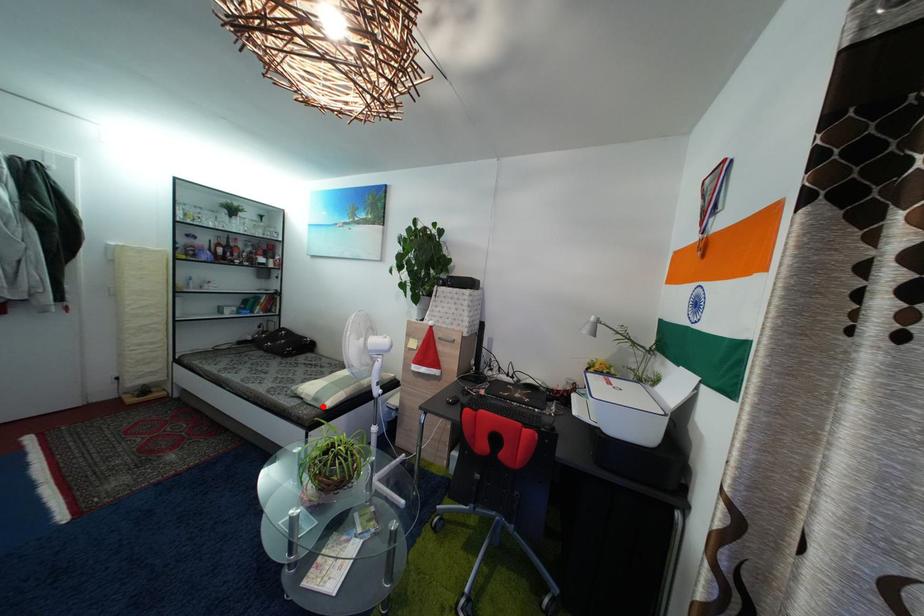
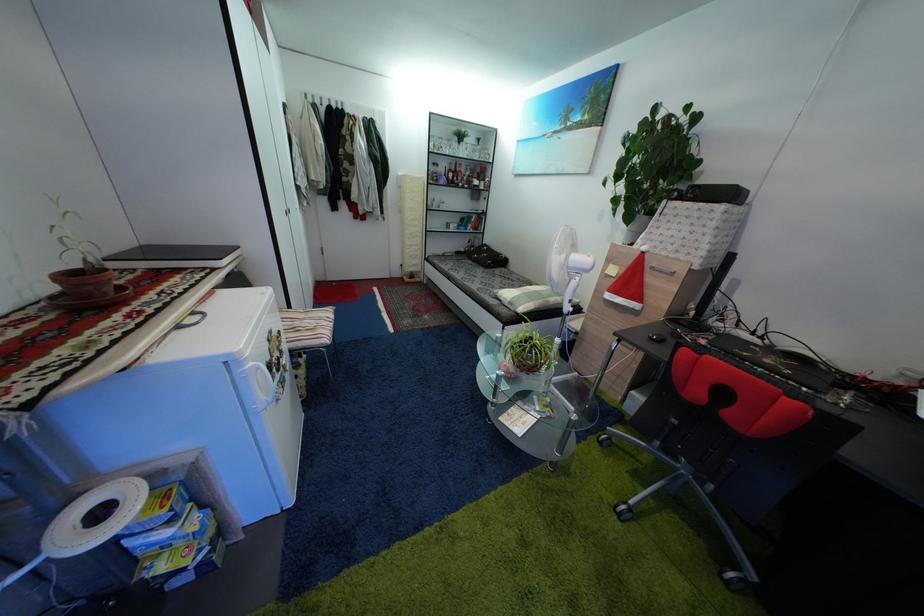
Question: I am providing you with two images of the same scene from different viewpoints. In image1, a red point is highlighted. Considering the same 3D point in image2, which of the following is correct?

Choices:
 (A) It is closer
 (B) It is farther

Answer: (A)